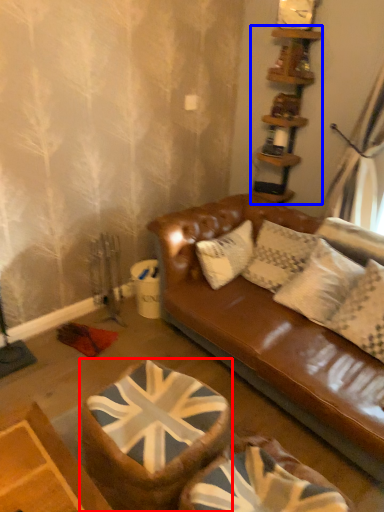
Question: Which object is closer to the camera taking this photo, swivel chair (highlighted by a red box) or shelf (highlighted by a blue box)?

Choices:
 (A) swivel chair
 (B) shelf

Answer: (A)